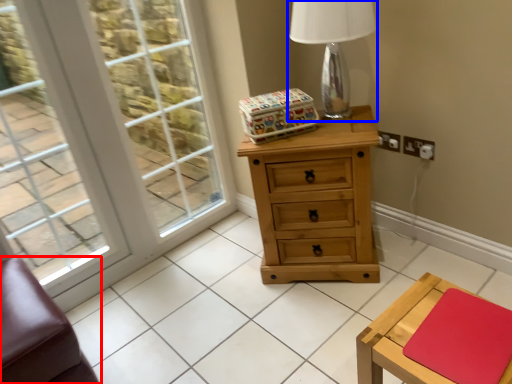
Question: Which point is closer to the camera, furniture (highlighted by a red box) or table lamp (highlighted by a blue box)?

Choices:
 (A) furniture
 (B) table lamp

Answer: (A)